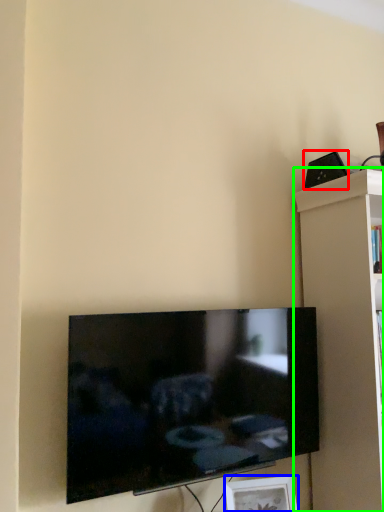
Question: Which is farther away from speaker (highlighted by a red box)? picture frame (highlighted by a blue box) or shelf (highlighted by a green box)?

Choices:
 (A) picture frame
 (B) shelf

Answer: (A)